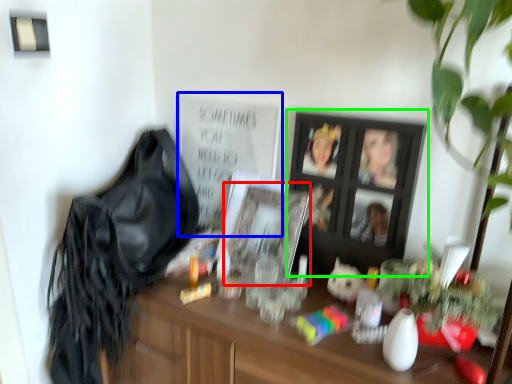
Question: Which is farther away from picture frame (highlighted by a red box)? bulletin board (highlighted by a blue box) or picture frame (highlighted by a green box)?

Choices:
 (A) bulletin board
 (B) picture frame

Answer: (A)